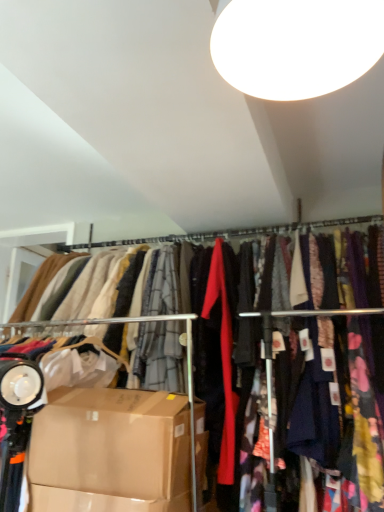
Question: Does white glossy light fixture at upper center have a larger size compared to brown cardboard box at lower left?

Choices:
 (A) no
 (B) yes

Answer: (A)

Question: Would you say white glossy light fixture at upper center is a long distance from brown cardboard box at lower left?

Choices:
 (A) yes
 (B) no

Answer: (A)

Question: Is brown cardboard box at lower left completely or partially inside white glossy light fixture at upper center?

Choices:
 (A) yes
 (B) no

Answer: (B)

Question: Considering the relative sizes of white glossy light fixture at upper center and brown cardboard box at lower left in the image provided, is white glossy light fixture at upper center taller than brown cardboard box at lower left?

Choices:
 (A) yes
 (B) no

Answer: (B)

Question: Can we say white glossy light fixture at upper center lies outside brown cardboard box at lower left?

Choices:
 (A) no
 (B) yes

Answer: (B)

Question: Which is correct: silky fabric clothesline at center is inside brown cardboard box at lower left, or outside of it?

Choices:
 (A) inside
 (B) outside

Answer: (B)

Question: Considering the positions of silky fabric clothesline at center and brown cardboard box at lower left in the image, is silky fabric clothesline at center bigger or smaller than brown cardboard box at lower left?

Choices:
 (A) big
 (B) small

Answer: (B)

Question: Considering the positions of point (365, 216) and point (147, 453), is point (365, 216) closer or farther from the camera than point (147, 453)?

Choices:
 (A) farther
 (B) closer

Answer: (A)

Question: Is silky fabric clothesline at center wider or thinner than brown cardboard box at lower left?

Choices:
 (A) thin
 (B) wide

Answer: (A)

Question: In terms of height, does white glossy light fixture at upper center look taller or shorter compared to brown cardboard box at lower left?

Choices:
 (A) short
 (B) tall

Answer: (A)

Question: From the image's perspective, is white glossy light fixture at upper center positioned above or below brown cardboard box at lower left?

Choices:
 (A) below
 (B) above

Answer: (B)

Question: Do you think white glossy light fixture at upper center is within brown cardboard box at lower left, or outside of it?

Choices:
 (A) inside
 (B) outside

Answer: (B)

Question: Does point (279, 53) appear closer or farther from the camera than point (127, 493)?

Choices:
 (A) farther
 (B) closer

Answer: (B)

Question: Is brown cardboard box at lower left situated inside silky fabric clothesline at center or outside?

Choices:
 (A) outside
 (B) inside

Answer: (A)

Question: From the image's perspective, relative to silky fabric clothesline at center, is brown cardboard box at lower left above or below?

Choices:
 (A) below
 (B) above

Answer: (A)